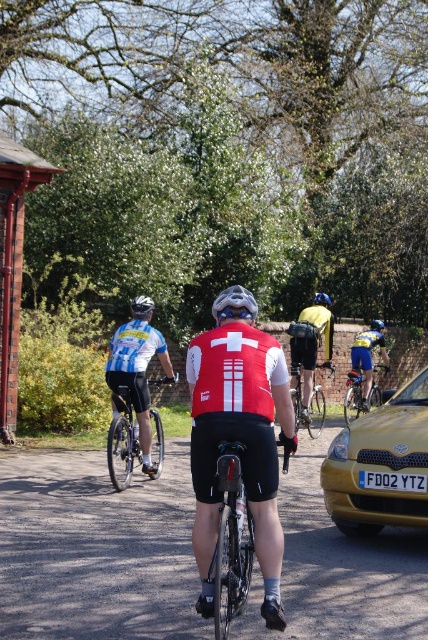
Question: Is yellow matte car at lower right to the left of white matte bicycle helmet at center from the viewer's perspective?

Choices:
 (A) yes
 (B) no

Answer: (B)

Question: Among these points, which one is nearest to the camera?

Choices:
 (A) (359, 365)
 (B) (407, 481)
 (C) (216, 346)

Answer: (C)

Question: Estimate the real-world distances between objects in this image. Which object is closer to the blue matte bicycle helmet at center?

Choices:
 (A) matte gray bicycle helmet at center
 (B) shiny metallic bicycle at center
 (C) blue matte helmet at center

Answer: (C)

Question: Is blue metallic bicycle at center wider than white matte bicycle helmet at center?

Choices:
 (A) yes
 (B) no

Answer: (B)

Question: Among these objects, which one is farthest from the camera?

Choices:
 (A) matte red cycling jersey at center
 (B) black plastic license plate at center
 (C) shiny black bicycle at center
 (D) blue metallic bicycle at center

Answer: (D)

Question: Is shiny metallic bicycle at center above blue matte helmet at center?

Choices:
 (A) no
 (B) yes

Answer: (A)